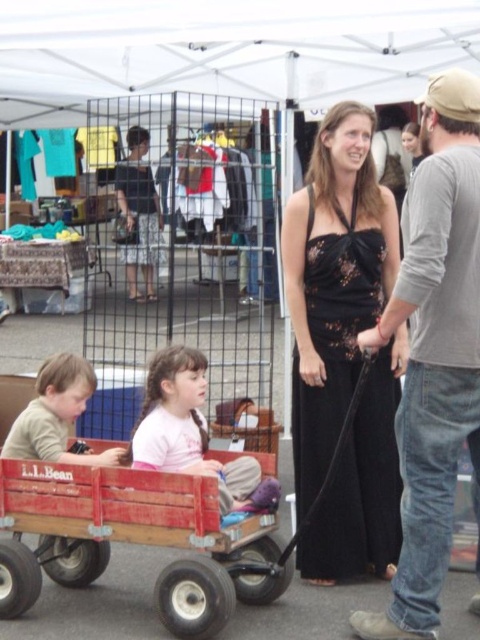
From the picture: You are a photographer trying to capture the black lace dress at center and the wooden wagon at center in a single shot. Since the dress is covering part of the wagon, how might you adjust your camera angle to ensure both are fully visible?

The black lace dress at center is positioned over the wooden wagon at center. To capture both fully, you could lower your camera angle to shoot from below the dress, allowing the wagon to be seen beneath it.

You are standing at the center of the market and want to find the black lace dress at center. According to the coordinates provided, in which direction should you look to locate it?

The black lace dress at center is located at coordinates point (x=334, y=282). Since you are at the center, you should look towards the lower right direction to find it.

You are a delivery person who needs to place a small package between the wooden wagon at center and the matte beige shirt at lower left. Is there enough space to fit the package between them?

The wooden wagon at center and the matte beige shirt at lower left are 18.34 inches apart, so yes, there is enough space to fit the package between them since 18.34 inches is more than sufficient for a small package.